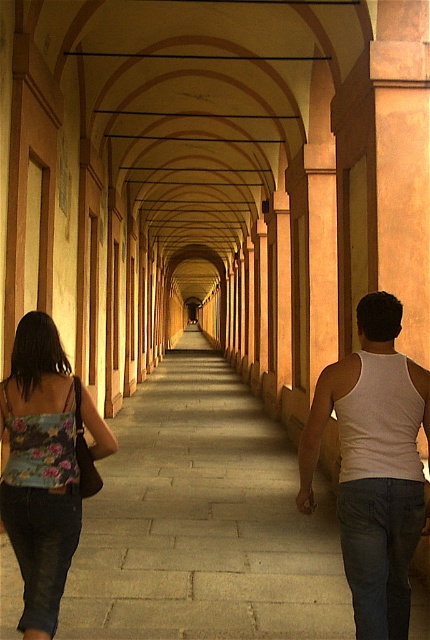
Question: Observing the image, what is the correct spatial positioning of gray stone pavement at center in reference to floral fabric tank top at lower left?

Choices:
 (A) right
 (B) left

Answer: (A)

Question: Which object appears farthest from the camera in this image?

Choices:
 (A) white tank top at center
 (B) gray stone pavement at center
 (C) floral fabric tank top at lower left

Answer: (B)

Question: Does gray stone pavement at center come in front of white tank top at center?

Choices:
 (A) no
 (B) yes

Answer: (A)

Question: Which point is closer to the camera?

Choices:
 (A) white tank top at center
 (B) gray stone pavement at center

Answer: (A)

Question: Is gray stone pavement at center further to the viewer compared to white tank top at center?

Choices:
 (A) yes
 (B) no

Answer: (A)

Question: Which object is the closest to the gray stone pavement at center?

Choices:
 (A) floral fabric tank top at lower left
 (B) white tank top at center

Answer: (A)